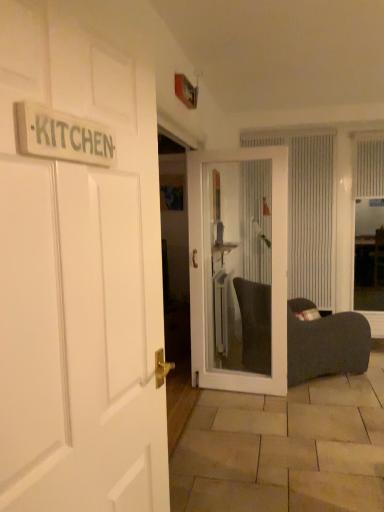
Measure the distance between white glass door at center, arranged as the 1th door when viewed from the right, and camera.

They are 3.10 meters apart.

Describe the element at coordinates (239, 268) in the screenshot. I see `white glass door at center, which ranks as the 2th door in front-to-back order` at that location.

Image resolution: width=384 pixels, height=512 pixels. What are the coordinates of `white textured curtain at upper right, the 2th curtain viewed from the left` in the screenshot? It's located at (368, 165).

What do you see at coordinates (368, 165) in the screenshot?
I see `white textured curtain at upper right, the 2th curtain viewed from the left` at bounding box center [368, 165].

The image size is (384, 512). Identify the location of white textured curtain at center, placed as the second curtain when sorted from right to left. (307, 211).

At what (x,y) coordinates should I click in order to perform the action: click on white wooden door at left, the 2th door when ordered from right to left. Please return your answer as a coordinate pair (x, y). Image resolution: width=384 pixels, height=512 pixels. Looking at the image, I should click on (79, 281).

Is dark gray fabric bean bag at right facing towards white textured window screen at right?

Yes, dark gray fabric bean bag at right is facing white textured window screen at right.

Is dark gray fabric bean bag at right inside the boundaries of white textured window screen at right, or outside?

dark gray fabric bean bag at right is not enclosed by white textured window screen at right.

From a real-world perspective, between white textured curtain at upper right, acting as the first curtain starting from the right, and white glass door at center, which ranks as the 2th door in front-to-back order, who is vertically higher?

white textured curtain at upper right, acting as the first curtain starting from the right, is physically above.

Is white textured curtain at upper right, acting as the first curtain starting from the right, in contact with white glass door at center, the 1th door positioned from the back?

No, white textured curtain at upper right, acting as the first curtain starting from the right, is not with white glass door at center, the 1th door positioned from the back.

From a real-world perspective, which door is the 2nd one underneath the white textured curtain at upper right, acting as the first curtain starting from the right? Please provide its 2D coordinates.

[(239, 268)]

Is white textured curtain at upper right, acting as the first curtain starting from the right, facing towards white glass door at center, the second door in the left-to-right sequence?

Answer: No, white textured curtain at upper right, acting as the first curtain starting from the right, does not turn towards white glass door at center, the second door in the left-to-right sequence.

From a real-world perspective, between wooden sign at upper left and white textured curtain at upper right, the 2th curtain viewed from the left, who is vertically higher?

white textured curtain at upper right, the 2th curtain viewed from the left, from a real-world perspective.

From the image's perspective, which is above, wooden sign at upper left or white textured curtain at upper right, acting as the first curtain starting from the right?

white textured curtain at upper right, acting as the first curtain starting from the right.

Could white textured curtain at upper right, acting as the first curtain starting from the right, be considered to be inside wooden sign at upper left?

Definitely not — white textured curtain at upper right, acting as the first curtain starting from the right, is not inside wooden sign at upper left.

Does wooden sign at upper left turn towards white textured curtain at upper right, acting as the first curtain starting from the right?

No, wooden sign at upper left does not turn towards white textured curtain at upper right, acting as the first curtain starting from the right.

Is wooden sign at upper left positioned with its back to white wooden door at left, arranged as the first door when viewed from the front?

Yes.

Can you confirm if wooden sign at upper left is positioned to the left of white wooden door at left, the second door from the back?

Indeed, wooden sign at upper left is positioned on the left side of white wooden door at left, the second door from the back.

The width and height of the screenshot is (384, 512). I want to click on sign above the white wooden door at left, the second door from the back (from the image's perspective), so click(63, 136).

Between wooden sign at upper left and white wooden door at left, the 2th door when ordered from right to left, which one is positioned behind?

Positioned behind is wooden sign at upper left.

From the image's perspective, which object appears higher, white glass door at center, the second door in the left-to-right sequence, or white textured window screen at right?

white textured window screen at right appears higher in the image.

Which object is positioned more to the left, white glass door at center, the 1th door positioned from the back, or white textured window screen at right?

From the viewer's perspective, white glass door at center, the 1th door positioned from the back, appears more on the left side.

Considering the relative sizes of white glass door at center, arranged as the 1th door when viewed from the right, and white textured window screen at right in the image provided, is white glass door at center, arranged as the 1th door when viewed from the right, taller than white textured window screen at right?

No.

In the scene shown: Which object is more forward, white textured window screen at right or white wooden door at left, arranged as the first door when viewed from the front?

Positioned in front is white wooden door at left, arranged as the first door when viewed from the front.

Who is taller, white textured window screen at right or white wooden door at left, the 2th door when ordered from right to left?

Standing taller between the two is white textured window screen at right.

From the image's perspective, is white textured window screen at right positioned above or below white wooden door at left, the 2th door when ordered from right to left?

From the image's perspective, white textured window screen at right appears above white wooden door at left, the 2th door when ordered from right to left.

Considering the positions of objects white textured curtain at upper right, acting as the first curtain starting from the right, and wooden sign at upper left in the image provided, who is more to the right, white textured curtain at upper right, acting as the first curtain starting from the right, or wooden sign at upper left?

white textured curtain at upper right, acting as the first curtain starting from the right, is more to the right.

Based on the photo, considering the relative sizes of white textured curtain at upper right, the 2th curtain viewed from the left, and wooden sign at upper left in the image provided, is white textured curtain at upper right, the 2th curtain viewed from the left, shorter than wooden sign at upper left?

No.

From the image's perspective, who appears lower, white textured curtain at upper right, the 2th curtain viewed from the left, or wooden sign at upper left?

wooden sign at upper left, from the image's perspective.

How much distance is there between white textured curtain at upper right, acting as the first curtain starting from the right, and wooden sign at upper left?

white textured curtain at upper right, acting as the first curtain starting from the right, is 14.01 feet from wooden sign at upper left.

In order to click on window screen to the right of dark gray fabric bean bag at right in this screenshot , I will do `click(368, 261)`.

Image resolution: width=384 pixels, height=512 pixels. I want to click on the 1st curtain behind when counting from the white glass door at center, which ranks as the 2th door in front-to-back order, so click(x=368, y=165).

Estimate the real-world distances between objects in this image. Which object is closer to white wooden door at left, which is counted as the first door, starting from the left, wooden sign at upper left or white glass door at center, the 1th door positioned from the back?

wooden sign at upper left is closer to white wooden door at left, which is counted as the first door, starting from the left.

When comparing their distances from white wooden door at left, arranged as the first door when viewed from the front, does white textured window screen at right or white textured curtain at upper right, the 2th curtain viewed from the left, seem further?

The object further to white wooden door at left, arranged as the first door when viewed from the front, is white textured curtain at upper right, the 2th curtain viewed from the left.

Looking at the image, which one is located further to white wooden door at left, the 2th door when ordered from right to left, dark gray fabric bean bag at right or white textured window screen at right?

white textured window screen at right.

Estimate the real-world distances between objects in this image. Which object is closer to white textured window screen at right, white wooden door at left, the 2th door when ordered from right to left, or dark gray fabric bean bag at right?

The object closer to white textured window screen at right is dark gray fabric bean bag at right.

Looking at the image, which one is located closer to white wooden door at left, which is counted as the first door, starting from the left, white textured window screen at right or white textured curtain at center, placed as the second curtain when sorted from right to left?

Based on the image, white textured curtain at center, placed as the second curtain when sorted from right to left, appears to be nearer to white wooden door at left, which is counted as the first door, starting from the left.

Based on their spatial positions, is white textured curtain at center, placed as the second curtain when sorted from right to left, or dark gray fabric bean bag at right further from white glass door at center, the 1th door positioned from the back?

Based on the image, white textured curtain at center, placed as the second curtain when sorted from right to left, appears to be further to white glass door at center, the 1th door positioned from the back.

Considering their positions, is dark gray fabric bean bag at right positioned closer to white textured window screen at right than white textured curtain at upper right, the 2th curtain viewed from the left?

white textured curtain at upper right, the 2th curtain viewed from the left, lies closer to white textured window screen at right than the other object.

From the picture: Based on their spatial positions, is white wooden door at left, arranged as the first door when viewed from the front, or wooden sign at upper left further from dark gray fabric bean bag at right?

wooden sign at upper left.

In order to click on sign between white wooden door at left, the second door from the back, and white textured window screen at right, along the z-axis in this screenshot , I will do `click(63, 136)`.

Where is `window screen between white wooden door at left, which is counted as the first door, starting from the left, and white textured curtain at upper right, the 2th curtain viewed from the left, from front to back`? window screen between white wooden door at left, which is counted as the first door, starting from the left, and white textured curtain at upper right, the 2th curtain viewed from the left, from front to back is located at coordinates (368, 261).

At what (x,y) coordinates should I click in order to perform the action: click on bean bag chair positioned between wooden sign at upper left and white textured curtain at upper right, the 2th curtain viewed from the left, from near to far. Please return your answer as a coordinate pair (x, y). This screenshot has width=384, height=512. Looking at the image, I should click on (325, 344).

The image size is (384, 512). Identify the location of door between white wooden door at left, which is counted as the first door, starting from the left, and white textured window screen at right, along the z-axis. (239, 268).